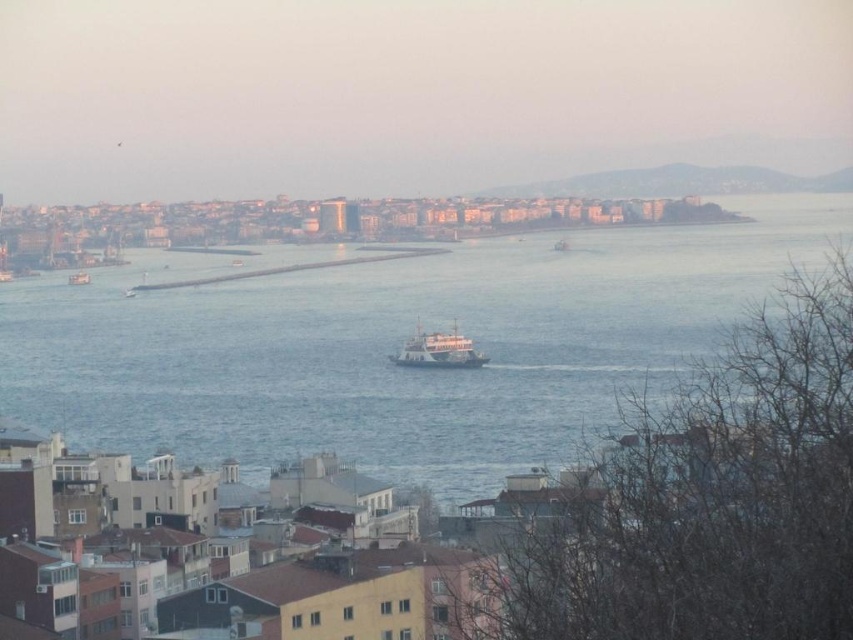
Question: Estimate the real-world distances between objects in this image. Which object is farther from the white matte boat at left?

Choices:
 (A) white matte ferry at center
 (B) blue water at center

Answer: (A)

Question: Is blue water at center bigger than white matte boat at left?

Choices:
 (A) no
 (B) yes

Answer: (B)

Question: Which point is closer to the camera taking this photo?

Choices:
 (A) (436, 339)
 (B) (483, 240)

Answer: (A)

Question: Is blue water at center bigger than white matte boat at left?

Choices:
 (A) yes
 (B) no

Answer: (A)

Question: Can you confirm if blue water at center is positioned above white matte boat at left?

Choices:
 (A) yes
 (B) no

Answer: (B)

Question: Among these points, which one is farthest from the camera?

Choices:
 (A) (618, 248)
 (B) (468, 355)

Answer: (A)